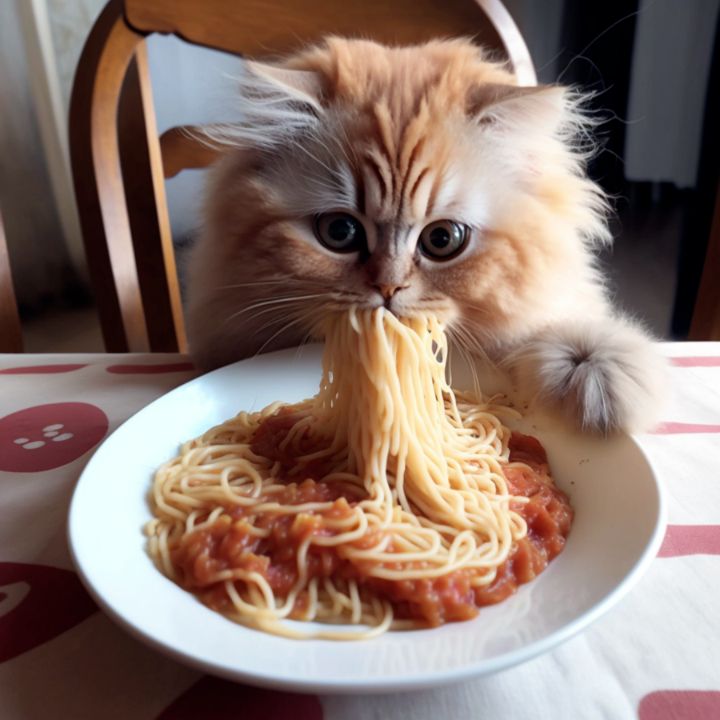
This screenshot has width=720, height=720. In order to click on red designs on white tablecloth in this screenshot , I will do `click(60, 603)`, `click(55, 454)`, `click(48, 366)`, `click(139, 366)`, `click(702, 539)`, `click(682, 423)`, `click(696, 363)`, `click(669, 700)`, `click(247, 703)`.